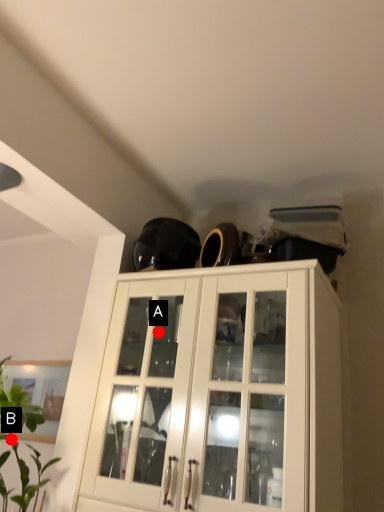
Question: Two points are circled on the image, labeled by A and B beside each circle. Which of the following is the farthest from the observer?

Choices:
 (A) A is further
 (B) B is further

Answer: (A)